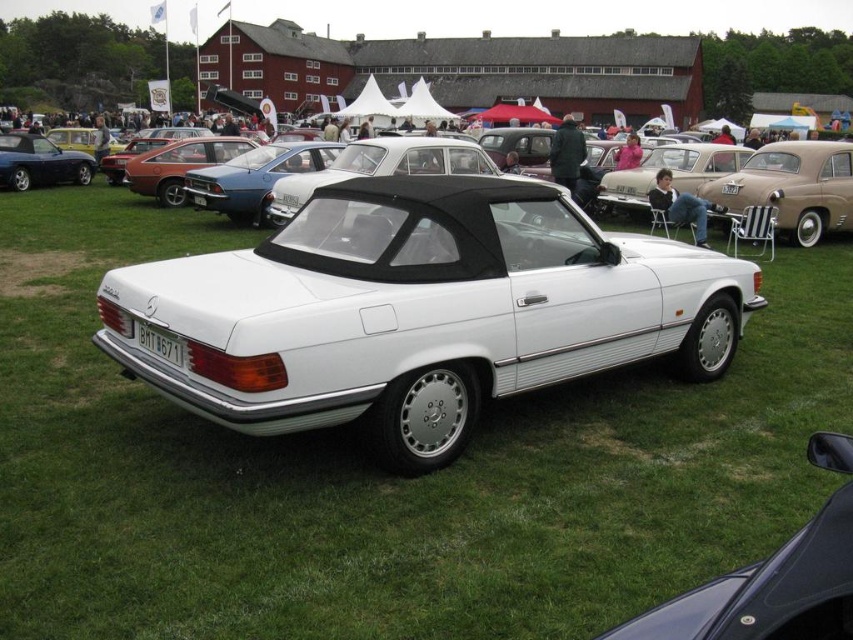
Who is higher up, matte black convertible at left or white plastic license plate at rear?

Positioned higher is matte black convertible at left.

Is point (83, 179) more distant than point (134, 323)?

Yes, point (83, 179) is behind point (134, 323).

Is point (36, 150) positioned behind point (141, 336)?

Yes, it is.

The height and width of the screenshot is (640, 853). Find the location of `matte black convertible at left`. matte black convertible at left is located at coordinates (39, 163).

Between white matte convertible at center and white metallic convertible at center, which one is positioned higher?

Positioned higher is white metallic convertible at center.

Is point (503, 362) farther from viewer compared to point (850, 148)?

No.

Find the location of a particular element. The width and height of the screenshot is (853, 640). white matte convertible at center is located at coordinates (421, 310).

Is white matte convertible at center positioned behind white plastic license plate at rear?

No, it is in front of white plastic license plate at rear.

The width and height of the screenshot is (853, 640). Describe the element at coordinates (421, 310) in the screenshot. I see `white matte convertible at center` at that location.

Where is `white matte convertible at center`? white matte convertible at center is located at coordinates (421, 310).